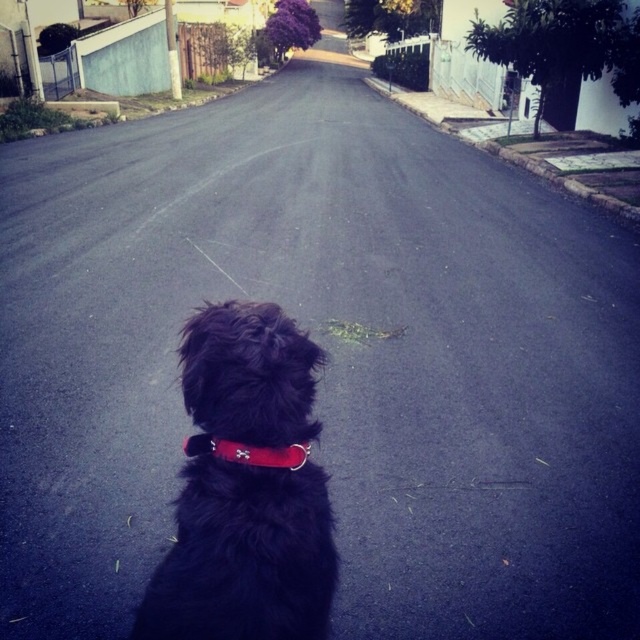
From the picture: Can you confirm if black fuzzy dog at center is wider than red matte neckband at center?

Yes.

Can you confirm if black fuzzy dog at center is thinner than red matte neckband at center?

In fact, black fuzzy dog at center might be wider than red matte neckband at center.

The width and height of the screenshot is (640, 640). Find the location of `black fuzzy dog at center`. black fuzzy dog at center is located at coordinates (246, 486).